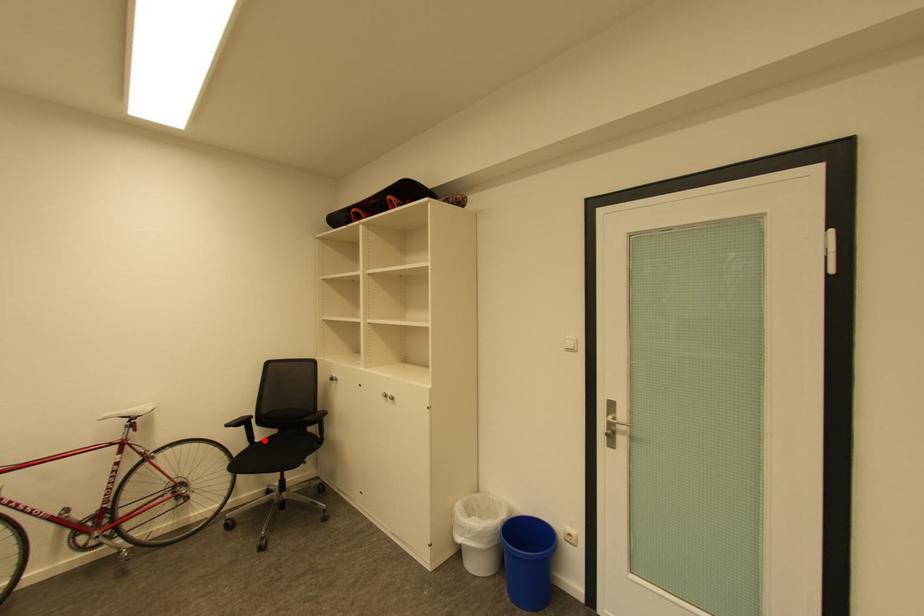
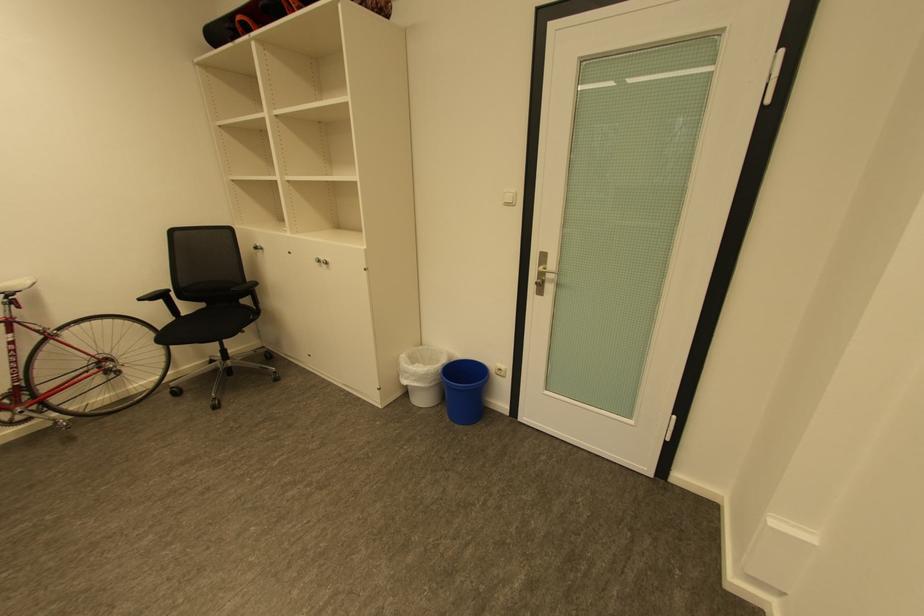
In the second image, find the point that corresponds to the highlighted location in the first image.

(190, 315)